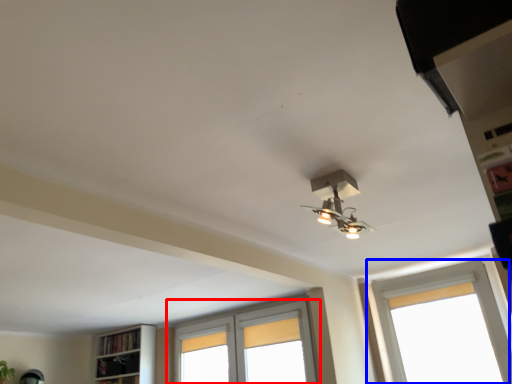
Question: Among these objects, which one is nearest to the camera, window (highlighted by a red box) or window (highlighted by a blue box)?

Choices:
 (A) window
 (B) window

Answer: (B)